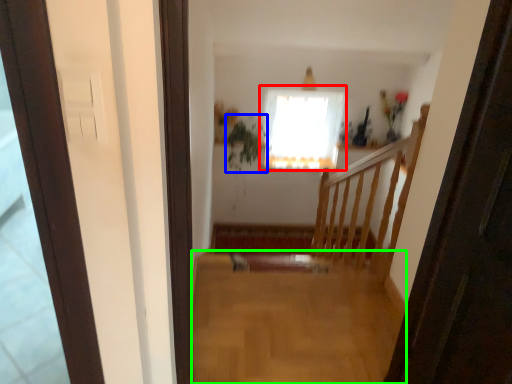
Question: Based on their relative distances, which object is farther from window (highlighted by a red box)? Choose from plant (highlighted by a blue box) and plain (highlighted by a green box).

Choices:
 (A) plant
 (B) plain

Answer: (B)